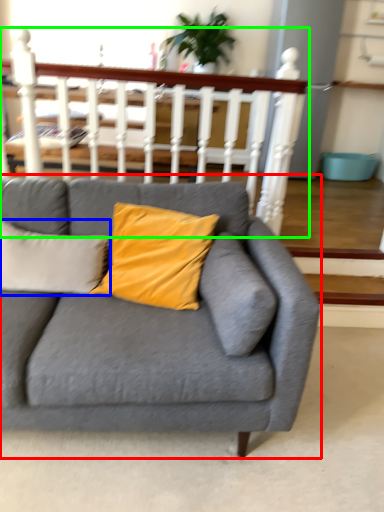
Question: Based on their relative distances, which object is nearer to studio couch (highlighted by a red box)? Choose from pillow (highlighted by a blue box) and balustrade (highlighted by a green box).

Choices:
 (A) pillow
 (B) balustrade

Answer: (A)